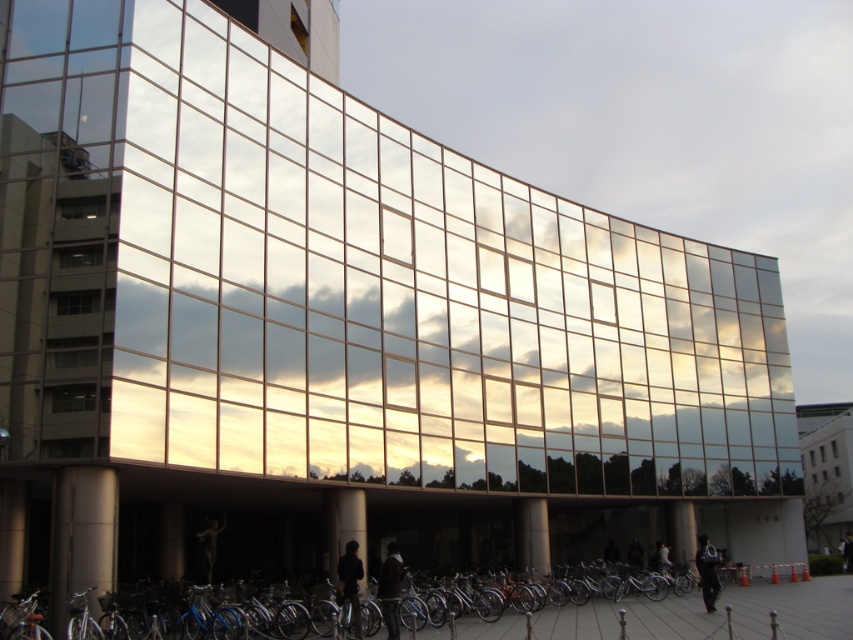
Is point (225, 612) closer to camera compared to point (660, 557)?

That is True.

Can you confirm if silver metallic bicycle at lower center is bigger than dark brown leather jacket at lower right?

Indeed, silver metallic bicycle at lower center has a larger size compared to dark brown leather jacket at lower right.

Identify the location of silver metallic bicycle at lower center. This screenshot has width=853, height=640. (590, 612).

Measure the distance between point (517, 620) and camera.

Point (517, 620) is 119.64 feet away from camera.

Is the position of silver metallic bicycle at lower center more distant than that of dark blue fabric jacket at lower right?

No, silver metallic bicycle at lower center is closer to the viewer.

What are the coordinates of `silver metallic bicycle at lower center` in the screenshot? It's located at (590, 612).

This screenshot has height=640, width=853. I want to click on silver metallic bicycle at lower center, so click(x=590, y=612).

Does dark brown leather jacket at lower center have a greater width compared to dark brown leather jacket at lower right?

In fact, dark brown leather jacket at lower center might be narrower than dark brown leather jacket at lower right.

At what (x,y) coordinates should I click in order to perform the action: click on dark brown leather jacket at lower center. Please return your answer as a coordinate pair (x, y). The width and height of the screenshot is (853, 640). Looking at the image, I should click on (390, 589).